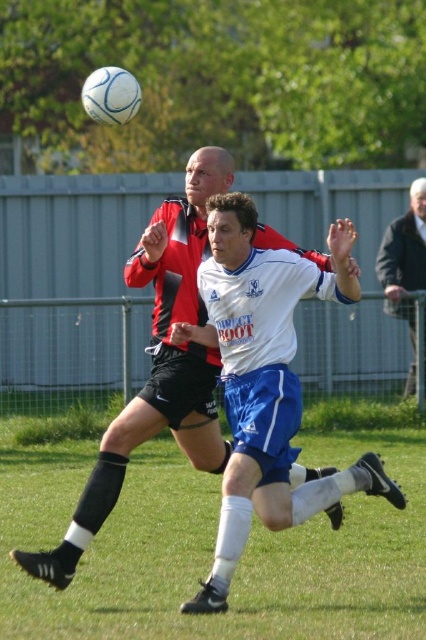
Who is positioned more to the left, white matte soccer ball at center or black matte shorts at center?

Positioned to the left is black matte shorts at center.

Between point (233, 292) and point (152, 324), which one is positioned behind?

The point (152, 324) is more distant.

Which is behind, point (267, 388) or point (63, 580)?

The point (267, 388) is more distant.

Find the location of `white matte soccer ball at center`. white matte soccer ball at center is located at coordinates (265, 380).

Does black matte shorts at center appear under dark gray wool jacket at right?

Yes, black matte shorts at center is below dark gray wool jacket at right.

Which is more to the left, black matte shorts at center or dark gray wool jacket at right?

black matte shorts at center

Identify the location of black matte shorts at center. (158, 364).

Does green grass at center appear over white matte soccer ball at center?

No.

Who is higher up, green grass at center or white matte soccer ball at center?

white matte soccer ball at center is higher up.

Which is in front, point (316, 589) or point (216, 547)?

Point (216, 547) is more forward.

Where is `green grass at center`? green grass at center is located at coordinates (213, 548).